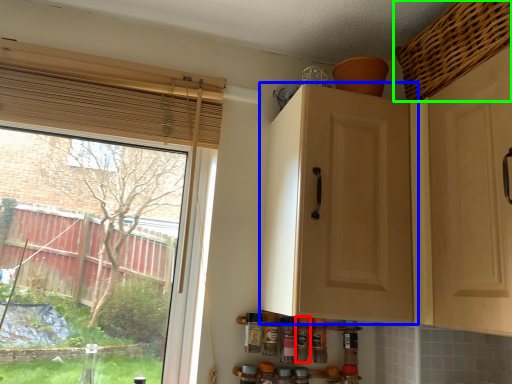
Question: Which object is positioned closest to bottle (highlighted by a red box)? Select from cabinetry (highlighted by a blue box) and basket (highlighted by a green box).

Choices:
 (A) cabinetry
 (B) basket

Answer: (A)